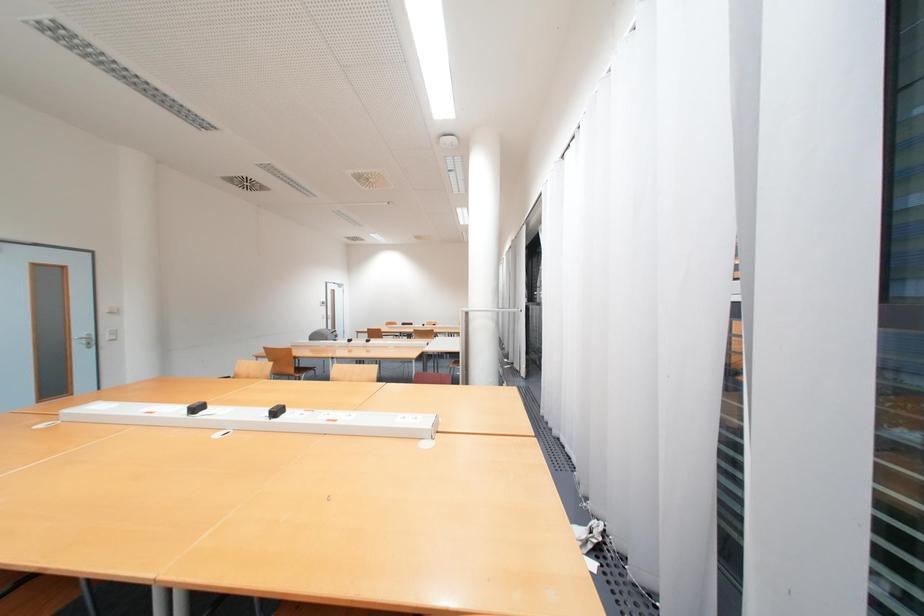
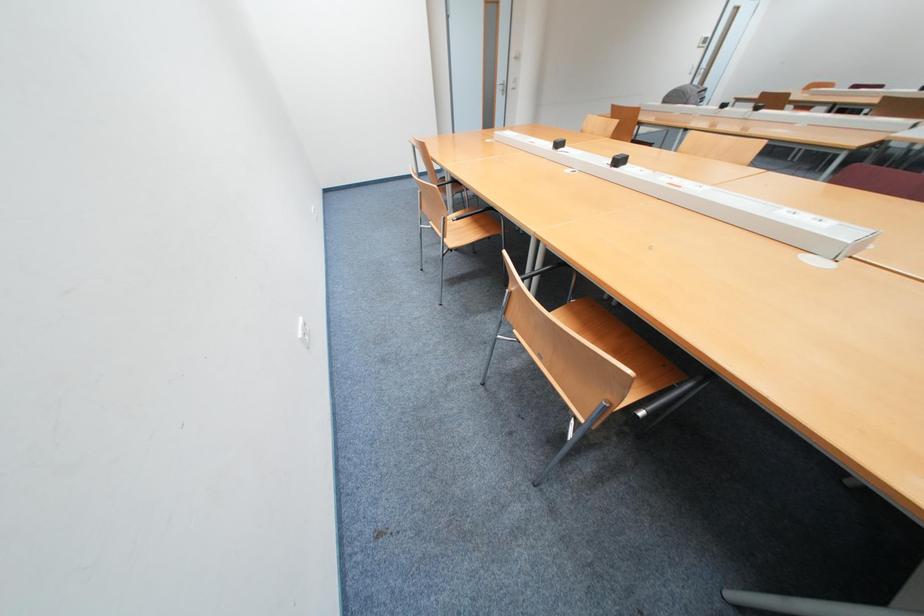
Based on the continuous images, in which direction is the camera rotating?

The camera rotated toward left-down.